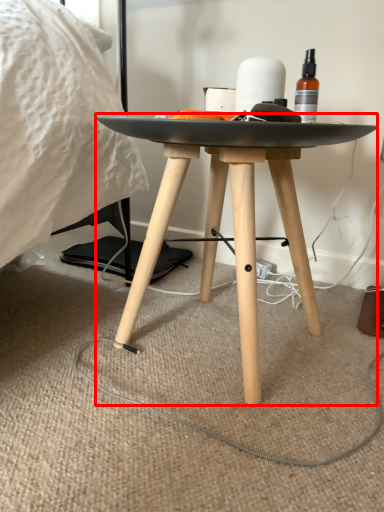
Question: Considering the relative positions of table (annotated by the red box) and toilet paper in the image provided, where is table (annotated by the red box) located with respect to the staircase?

Choices:
 (A) right
 (B) left

Answer: (B)